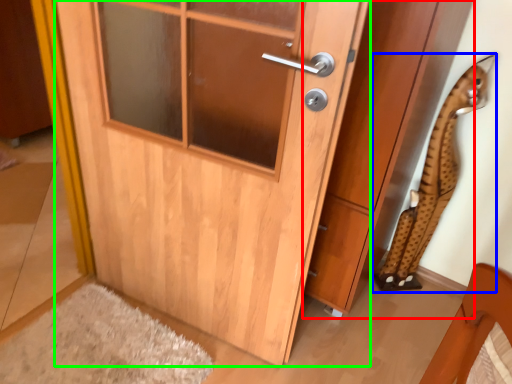
Question: Based on their relative distances, which object is farther from cabinetry (highlighted by a red box)? Choose from animal (highlighted by a blue box) and door (highlighted by a green box).

Choices:
 (A) animal
 (B) door

Answer: (B)